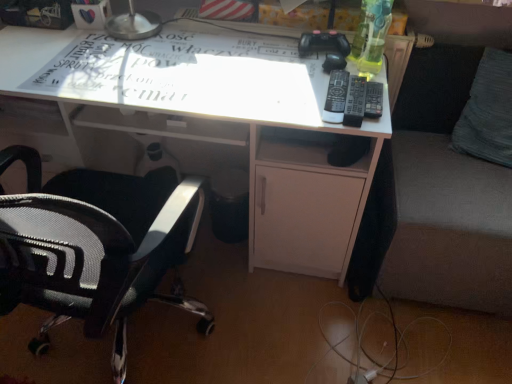
Find the location of a particular element. free space behind black plastic remote at upper right, the third remote from the right is located at coordinates (315, 68).